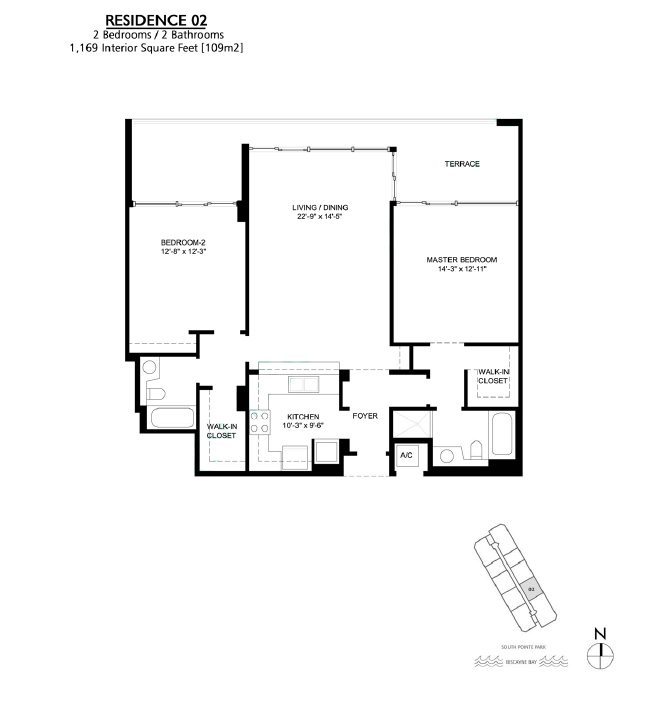
At what (x,y) coordinates should I click in order to perform the action: click on living and dining room. Please return your answer as a coordinate pair (x, y). Looking at the image, I should click on (328, 259).